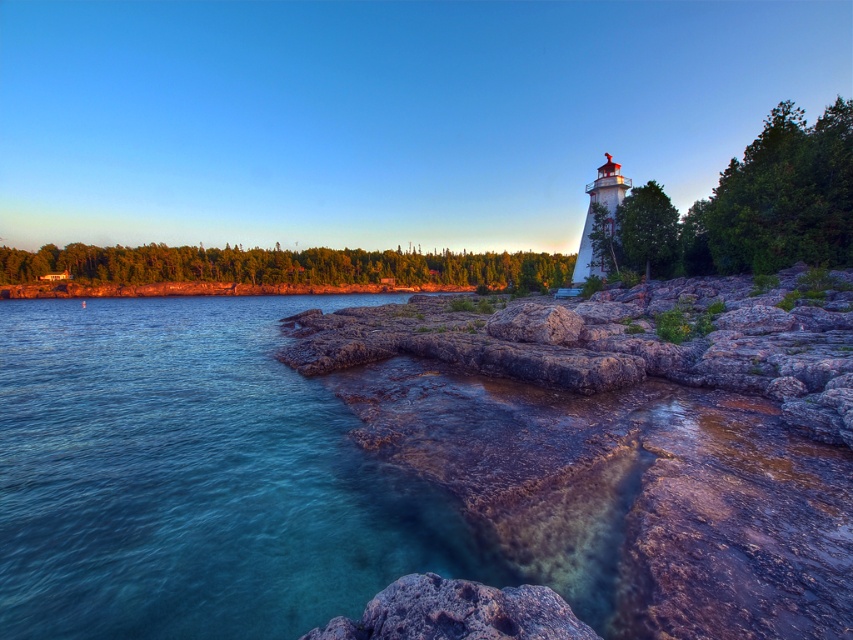
Question: Is rockysmooth rockrocky at right further to camera compared to clear blue water at lower left?

Choices:
 (A) no
 (B) yes

Answer: (A)

Question: Can you confirm if rockysmooth rockrocky at right is positioned above rusty rock at lower center?

Choices:
 (A) yes
 (B) no

Answer: (A)

Question: Which point is closer to the camera taking this photo?

Choices:
 (A) (567, 520)
 (B) (270, 298)
 (C) (440, 596)

Answer: (C)

Question: Which object is farther from the camera taking this photo?

Choices:
 (A) rusty rock at center
 (B) rockysmooth rockrocky at right
 (C) rusty rock at lower center
 (D) clear blue water at lower left

Answer: (A)

Question: From the image, what is the correct spatial relationship of rockysmooth rockrocky at right in relation to rusty rock at center?

Choices:
 (A) left
 (B) right

Answer: (A)

Question: Which object is the closest to the rockysmooth rockrocky at right?

Choices:
 (A) rusty rock at lower center
 (B) rusty rock at center
 (C) clear blue water at lower left

Answer: (B)